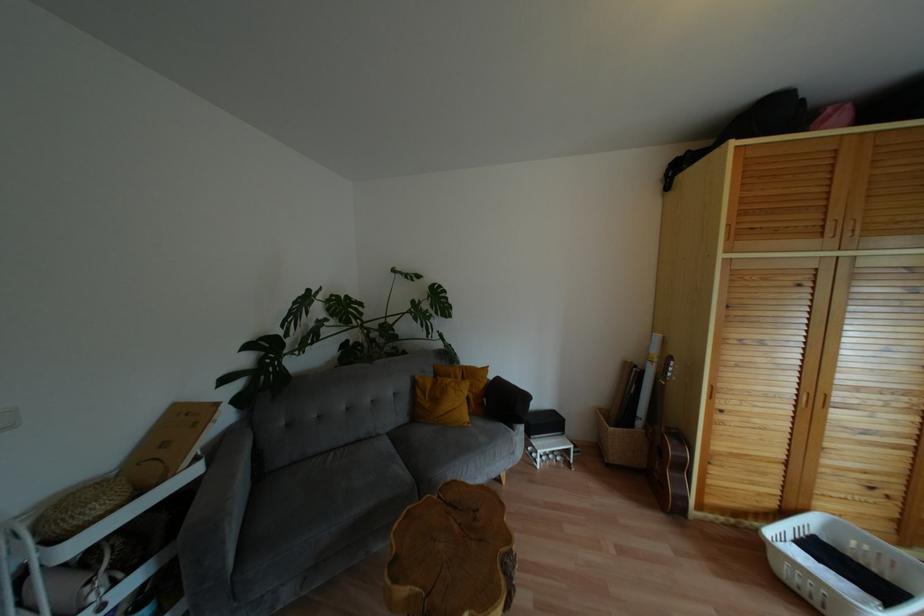
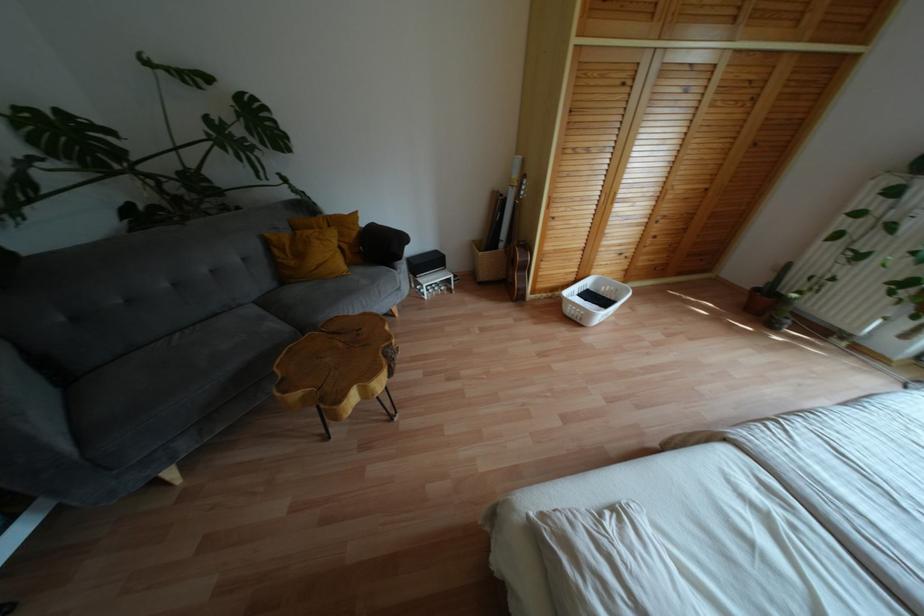
Locate, in the second image, the point that corresponds to (466,418) in the first image.

(343, 267)